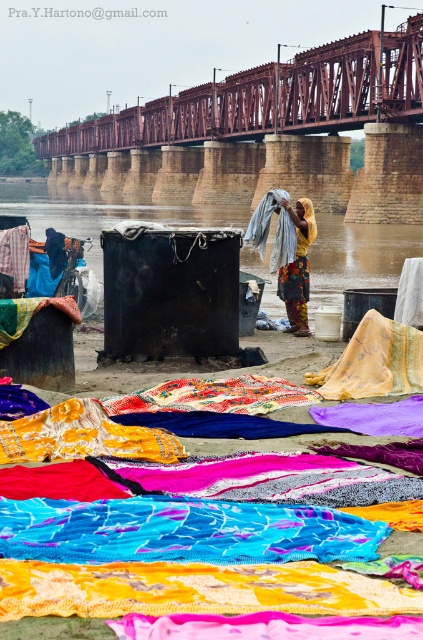
Question: Which object is closer to the camera taking this photo?

Choices:
 (A) brown concrete river at center
 (B) yellow sheer cloth at center
 (C) rusty metal bridge at upper center
 (D) multicolored fabric at center

Answer: (B)

Question: Which of these objects is positioned farthest from the multicolored fabric at center?

Choices:
 (A) yellow sheer cloth at center
 (B) brown concrete river at center

Answer: (B)

Question: From the image, what is the correct spatial relationship of rusty metal bridge at upper center in relation to multicolored fabric at center?

Choices:
 (A) below
 (B) above

Answer: (B)

Question: Can you confirm if rusty metal bridge at upper center is bigger than brown concrete river at center?

Choices:
 (A) yes
 (B) no

Answer: (B)

Question: Which object is the closest to the brown concrete river at center?

Choices:
 (A) yellow sheer cloth at center
 (B) rusty metal bridge at upper center

Answer: (B)

Question: Can you confirm if yellow sheer cloth at center is wider than multicolored fabric at center?

Choices:
 (A) yes
 (B) no

Answer: (A)